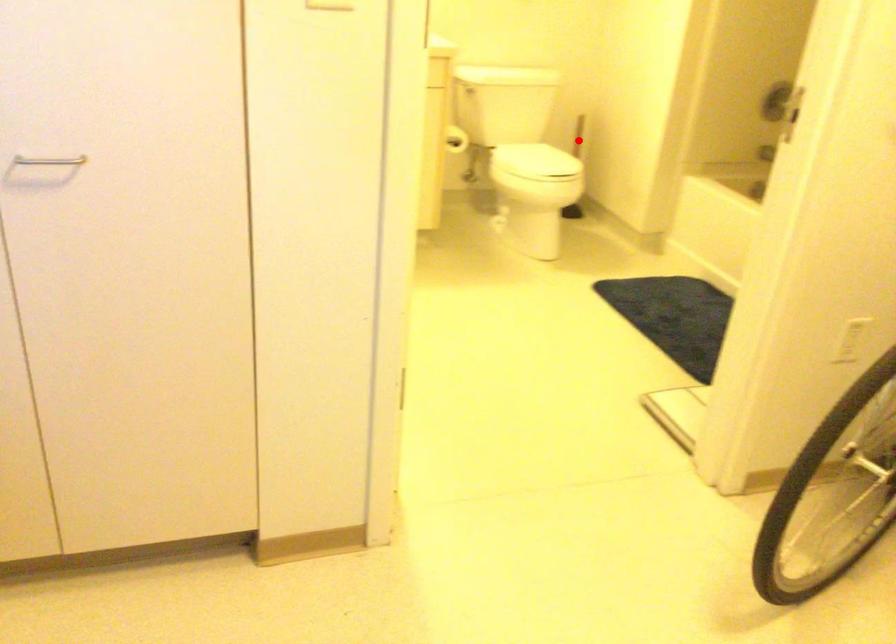
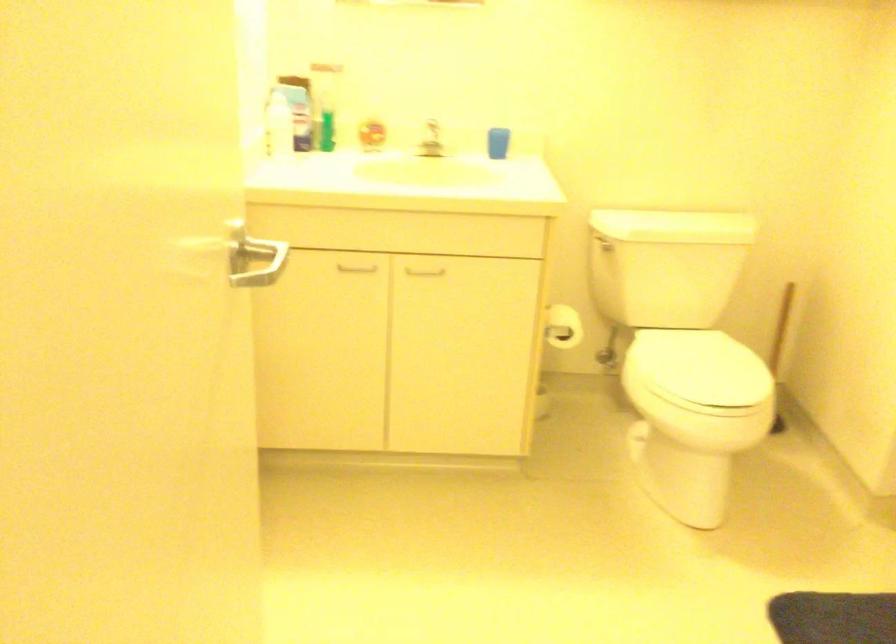
Question: I am providing you with two images of the same scene from different viewpoints. Given a red point in image1, look at the same physical point in image2. Is it:

Choices:
 (A) Closer to the viewpoint
 (B) Farther from the viewpoint

Answer: (A)